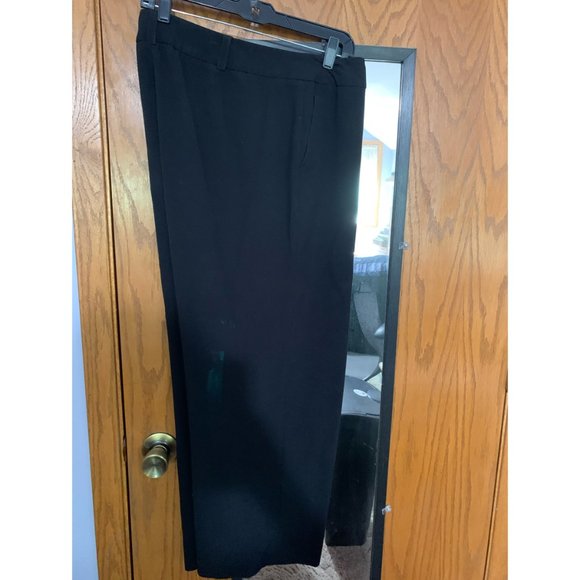
Where is `mirror pins`? The image size is (580, 580). mirror pins is located at coordinates (385, 508), (401, 252).